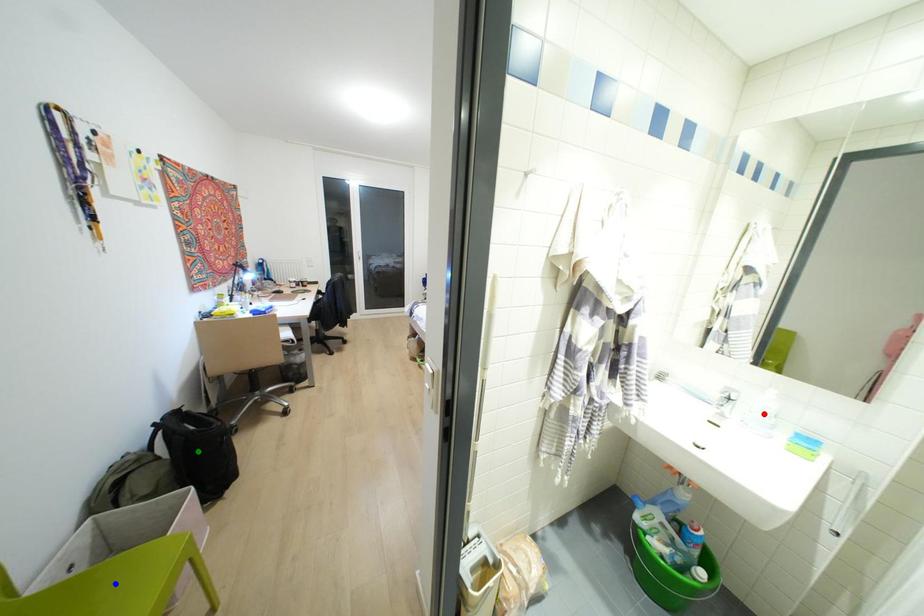
Order these from nearest to farthest:
1. blue point
2. green point
3. red point

blue point
red point
green point